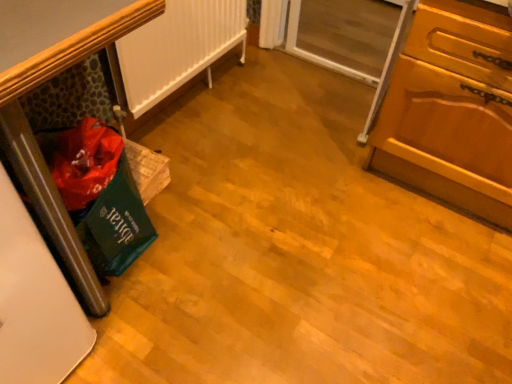
Identify the location of vacant space in between wooden cabinet at right and green fabric bag at left. (295, 197).